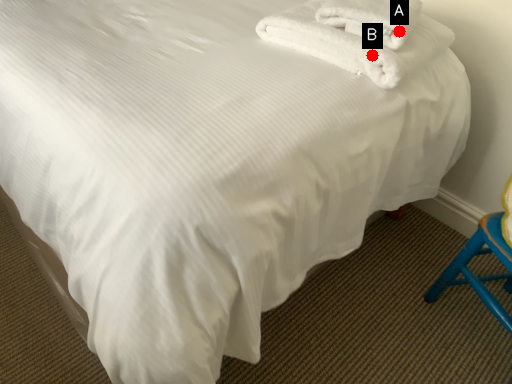
Question: Two points are circled on the image, labeled by A and B beside each circle. Which point is farther to the camera?

Choices:
 (A) A is further
 (B) B is further

Answer: (A)